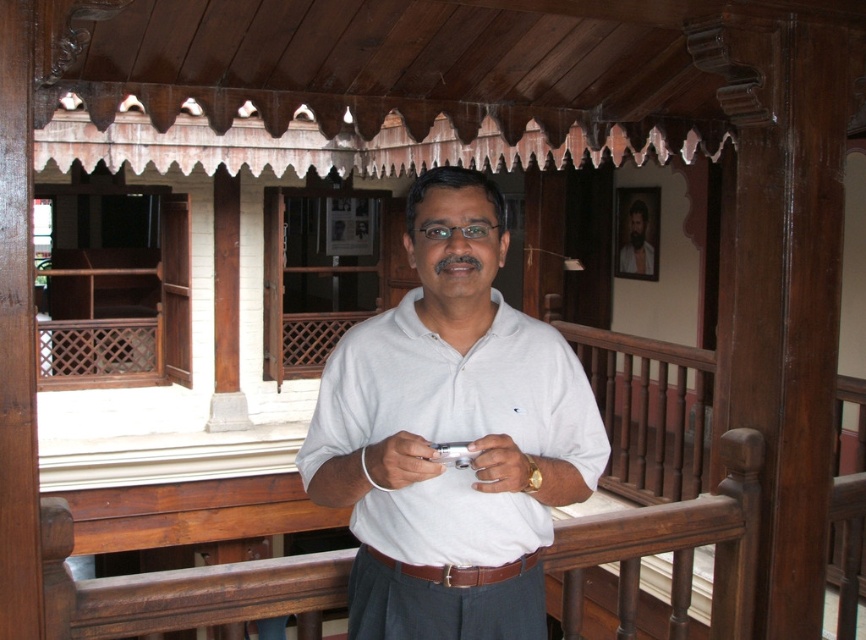
Question: Which object is closer to the camera taking this photo?

Choices:
 (A) brown leather belt at center
 (B) white matte wristband at center
 (C) white matte hand at center
 (D) white matte shirt at center

Answer: (B)

Question: Which of these objects is positioned closest to the bearded man at center?

Choices:
 (A) white matte hand at center
 (B) brown leather belt at center

Answer: (B)

Question: From the image, what is the correct spatial relationship of white matte wristband at center in relation to white matte hand at center?

Choices:
 (A) left
 (B) right

Answer: (A)

Question: Among these points, which one is farthest from the camera?

Choices:
 (A) (479, 570)
 (B) (333, 492)
 (C) (619, 252)
 (D) (512, 452)

Answer: (C)

Question: Can you confirm if white matte hand at center is positioned below bearded man at center?

Choices:
 (A) no
 (B) yes

Answer: (B)

Question: Is white matte shirt at center above bearded man at center?

Choices:
 (A) yes
 (B) no

Answer: (B)